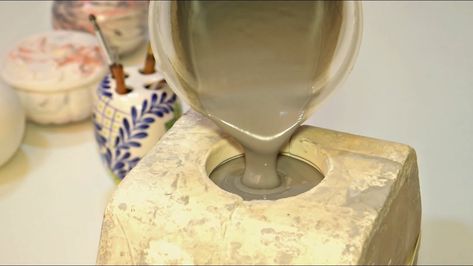
Image resolution: width=473 pixels, height=266 pixels. Identify the location of white surfaces. (30, 189).